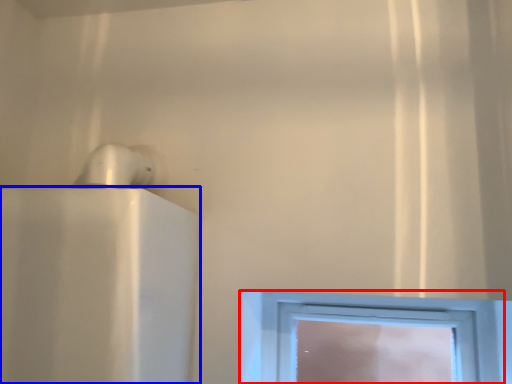
Question: Which of the following is the closest to the observer, window (highlighted by a red box) or appliance (highlighted by a blue box)?

Choices:
 (A) window
 (B) appliance

Answer: (B)